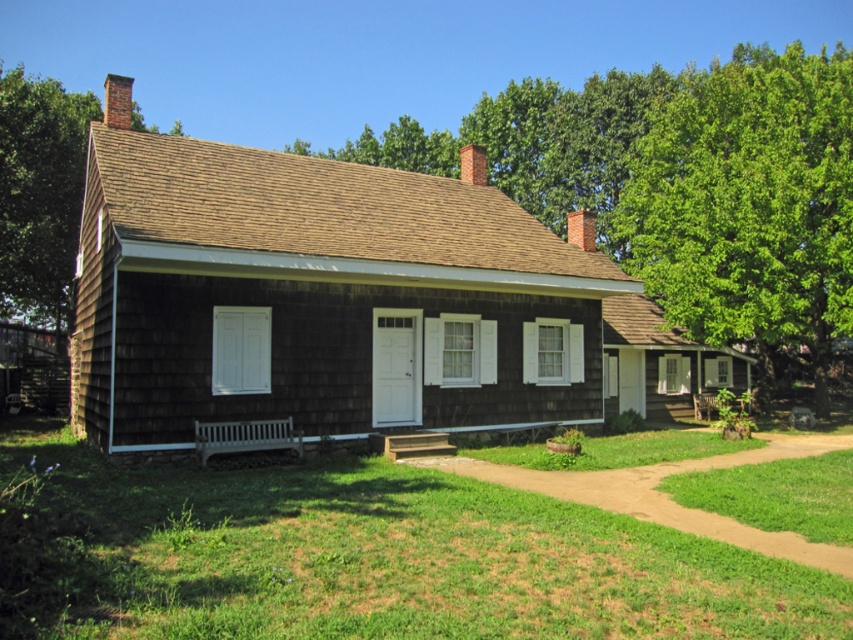
Can you confirm if green grass at lower center is smaller than brown shingles at upper left?

Correct, green grass at lower center occupies less space than brown shingles at upper left.

Which is more to the right, green grass at lower center or brown shingles at upper left?

green grass at lower center

This screenshot has height=640, width=853. Find the location of `green grass at lower center`. green grass at lower center is located at coordinates (379, 556).

Can you confirm if green leafy tree at upper right is shorter than brown shingles at upper left?

In fact, green leafy tree at upper right may be taller than brown shingles at upper left.

Does point (827, 342) come farther from viewer compared to point (10, 292)?

No.

The image size is (853, 640). I want to click on green leafy tree at upper right, so click(749, 202).

Can you confirm if green grass at lower center is taller than green leafy tree at upper right?

No.

Looking at this image, does green grass at lower center appear under green leafy tree at upper right?

Indeed, green grass at lower center is positioned under green leafy tree at upper right.

Is point (196, 605) farther from camera compared to point (691, 138)?

No, (196, 605) is closer to viewer.

The width and height of the screenshot is (853, 640). What are the coordinates of `green grass at lower center` in the screenshot? It's located at [x=379, y=556].